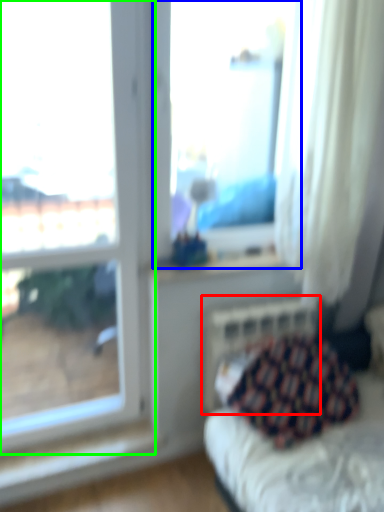
Question: Based on their relative distances, which object is nearer to radiator (highlighted by a red box)? Choose from window (highlighted by a blue box) and window (highlighted by a green box).

Choices:
 (A) window
 (B) window

Answer: (B)